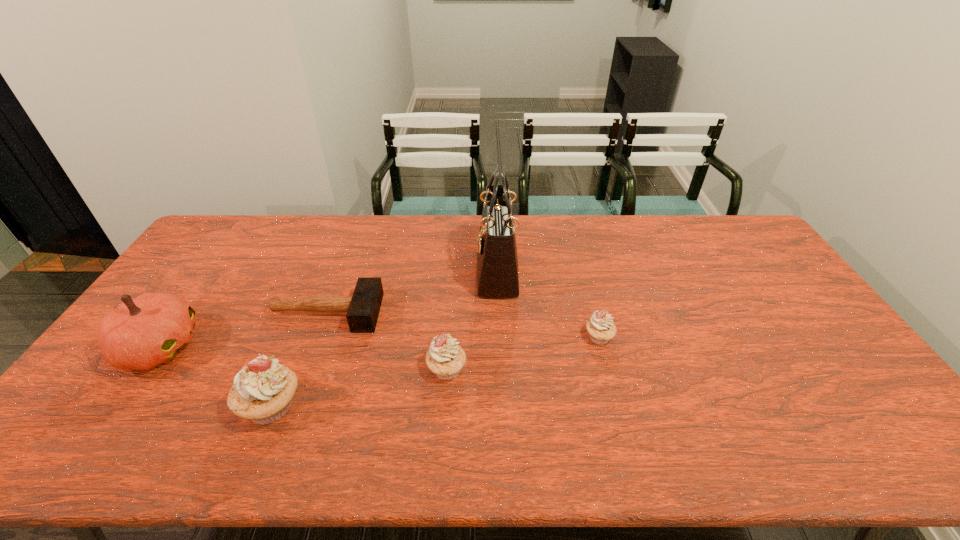
The width and height of the screenshot is (960, 540). Identify the location of the tallest cupcake. (263, 390).

This screenshot has height=540, width=960. Find the location of `the fourth object from left to right`. the fourth object from left to right is located at coordinates (445, 358).

At what (x,y) coordinates should I click in order to perform the action: click on the fourth tallest object. Please return your answer as a coordinate pair (x, y). The image size is (960, 540). Looking at the image, I should click on (445, 358).

The image size is (960, 540). Find the location of `the fifth tallest object`. the fifth tallest object is located at coordinates (600, 327).

Image resolution: width=960 pixels, height=540 pixels. Identify the location of the rightmost cupcake. (600, 327).

At what (x,y) coordinates should I click in order to perform the action: click on the tallest object. Please return your answer as a coordinate pair (x, y). The image size is (960, 540). Looking at the image, I should click on (497, 262).

The height and width of the screenshot is (540, 960). What are the coordinates of `handbag` in the screenshot? It's located at (497, 262).

Locate an element on the screen. This screenshot has width=960, height=540. the shortest object is located at coordinates (363, 308).

Identify the location of the leftmost object. (143, 332).

Find the location of a particular element. free space located 0.180m on the right of the tallest cupcake is located at coordinates (375, 407).